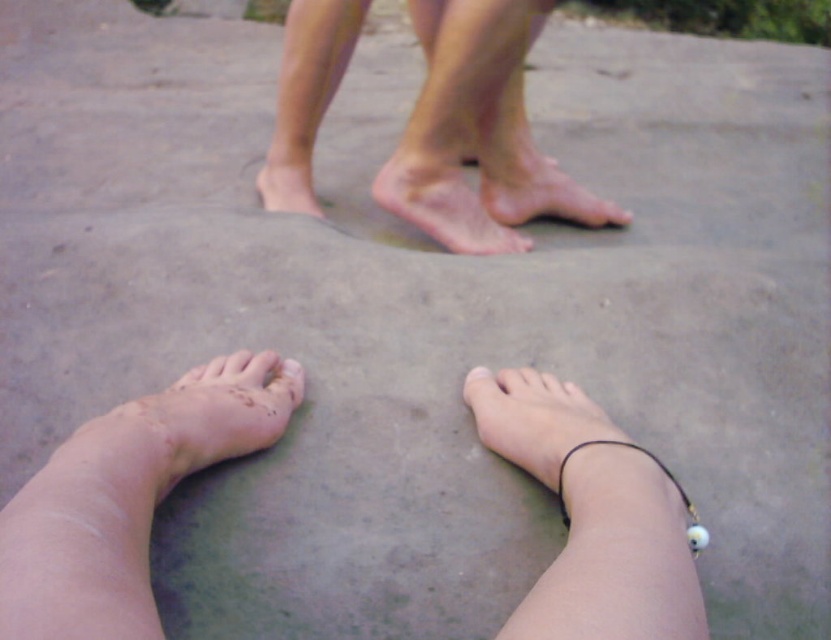
Who is more distant from viewer, (608, 214) or (235, 362)?

Positioned behind is point (608, 214).

Does point (487, 152) lie behind point (241, 369)?

Yes, point (487, 152) is farther from viewer.

The image size is (831, 640). Identify the location of smooth skin foot at upper center. (539, 192).

Between dry skin at lower left and smooth skin foot at upper center, which one appears on the left side from the viewer's perspective?

dry skin at lower left

Where is `dry skin at lower left`? dry skin at lower left is located at coordinates (219, 413).

Locate an element on the screen. dry skin at lower left is located at coordinates (219, 413).

The width and height of the screenshot is (831, 640). Describe the element at coordinates (234, 364) in the screenshot. I see `pale skin toe at lower left` at that location.

Which is behind, point (234, 358) or point (617, 218)?

The point (617, 218) is behind.

The width and height of the screenshot is (831, 640). What are the coordinates of `pale skin toe at lower left` in the screenshot? It's located at (234, 364).

At what (x,y) coordinates should I click in order to perform the action: click on pale skin toe at lower left. Please return your answer as a coordinate pair (x, y). The height and width of the screenshot is (640, 831). Looking at the image, I should click on (234, 364).